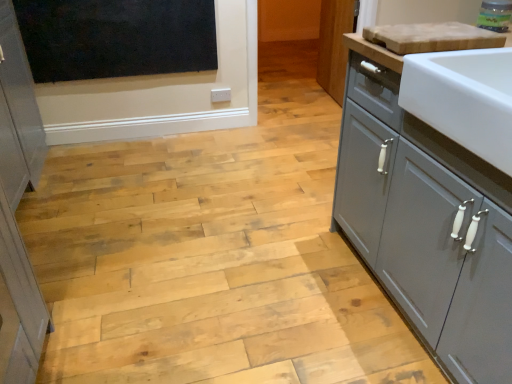
Find the location of a particular element. Image resolution: width=512 pixels, height=384 pixels. white glossy sink at right is located at coordinates (425, 221).

This screenshot has width=512, height=384. I want to click on white glossy sink at right, so click(425, 221).

How different are the orientations of translucent glass jar at upper right and matte gray cabinet at right in degrees?

The angle between the facing direction of translucent glass jar at upper right and the facing direction of matte gray cabinet at right is 95.5 degrees.

Is translucent glass jar at upper right taller or shorter than matte gray cabinet at right?

In the image, translucent glass jar at upper right appears to be shorter than matte gray cabinet at right.

Does translucent glass jar at upper right lie behind matte gray cabinet at right?

That is False.

Between point (488, 14) and point (325, 81), which one is positioned in front?

The point (488, 14) is in front.

Which point is more forward, (397, 55) or (357, 168)?

The point (397, 55) is closer.

From the image's perspective, which is below, light brown wood cutting board at upper right or white glossy sink at right?

white glossy sink at right, from the image's perspective.

From a real-world perspective, is light brown wood cutting board at upper right located beneath white glossy sink at right?

No.

Is white glossy sink at right inside light brown wood cutting board at upper right?

No, white glossy sink at right is not surrounded by light brown wood cutting board at upper right.

Could you measure the distance between translucent glass jar at upper right and light brown wood cutting board at upper right?

translucent glass jar at upper right is 14.10 inches away from light brown wood cutting board at upper right.

At what (x,y) coordinates should I click in order to perform the action: click on appliance to the right of light brown wood cutting board at upper right. Please return your answer as a coordinate pair (x, y). The image size is (512, 384). Looking at the image, I should click on (495, 15).

Is point (501, 7) positioned in front of point (357, 50)?

No, (501, 7) is behind (357, 50).

Is translucent glass jar at upper right far from light brown wood cutting board at upper right?

They are positioned close to each other.

Does point (99, 77) come in front of point (366, 51)?

No, it is not.

Can you tell me how much black matte window screen at upper left and light brown wood cutting board at upper right differ in facing direction?

The angular difference between black matte window screen at upper left and light brown wood cutting board at upper right is 90 degrees.

Could you measure the distance between black matte window screen at upper left and light brown wood cutting board at upper right?

black matte window screen at upper left and light brown wood cutting board at upper right are 1.74 meters apart.

Is black matte window screen at upper left far from light brown wood cutting board at upper right?

Yes.

Considering the positions of objects black matte window screen at upper left and translucent glass jar at upper right in the image provided, who is in front, black matte window screen at upper left or translucent glass jar at upper right?

translucent glass jar at upper right is closer to the camera.

This screenshot has height=384, width=512. In order to click on appliance on the right of black matte window screen at upper left in this screenshot , I will do `click(495, 15)`.

Is black matte window screen at upper left not near translucent glass jar at upper right?

Yes.

From the image's perspective, which object appears higher, black matte window screen at upper left or translucent glass jar at upper right?

black matte window screen at upper left.

In the scene shown: Is black matte window screen at upper left inside translucent glass jar at upper right?

No, translucent glass jar at upper right does not contain black matte window screen at upper left.

Is translucent glass jar at upper right placed right next to black matte window screen at upper left?

No, translucent glass jar at upper right is not in contact with black matte window screen at upper left.

In terms of height, does translucent glass jar at upper right look taller or shorter compared to black matte window screen at upper left?

translucent glass jar at upper right is shorter than black matte window screen at upper left.

Does point (488, 11) come behind point (71, 19)?

No, it is not.

From the image's perspective, is light brown wood cutting board at upper right under translucent glass jar at upper right?

Correct, light brown wood cutting board at upper right appears lower than translucent glass jar at upper right in the image.

Is light brown wood cutting board at upper right inside or outside of translucent glass jar at upper right?

light brown wood cutting board at upper right is outside translucent glass jar at upper right.

Considering the points (361, 36) and (496, 0), which point is in front, point (361, 36) or point (496, 0)?

The point (361, 36) is closer.

Considering the positions of objects light brown wood cutting board at upper right and translucent glass jar at upper right in the image provided, who is more to the right, light brown wood cutting board at upper right or translucent glass jar at upper right?

From the viewer's perspective, translucent glass jar at upper right appears more on the right side.

Identify the location of cabinetry behind the translucent glass jar at upper right. Image resolution: width=512 pixels, height=384 pixels. (334, 46).

The width and height of the screenshot is (512, 384). Identify the location of countertop on the left of white glossy sink at right. (374, 52).

Estimate the real-world distances between objects in this image. Which object is further from translucent glass jar at upper right, white glossy sink at right or light brown wood cutting board at upper right?

The object further to translucent glass jar at upper right is white glossy sink at right.

From the image, which object appears to be farther from white glossy sink at right, matte gray cabinet at right or black matte window screen at upper left?

Based on the image, matte gray cabinet at right appears to be further to white glossy sink at right.

From the picture: Considering their positions, is light brown wood cutting board at upper right positioned closer to black matte window screen at upper left than matte gray cabinet at right?

matte gray cabinet at right lies closer to black matte window screen at upper left than the other object.

When comparing their distances from black matte window screen at upper left, does translucent glass jar at upper right or white glossy sink at right seem closer?

white glossy sink at right is closer to black matte window screen at upper left.

Which object lies nearer to the anchor point matte gray cabinet at right, translucent glass jar at upper right or white glossy sink at right?

translucent glass jar at upper right is closer to matte gray cabinet at right.

Considering their positions, is black matte window screen at upper left positioned closer to white glossy sink at right than matte gray cabinet at right?

black matte window screen at upper left lies closer to white glossy sink at right than the other object.

Considering their positions, is white glossy sink at right positioned further to light brown wood cutting board at upper right than translucent glass jar at upper right?

white glossy sink at right lies further to light brown wood cutting board at upper right than the other object.

From the image, which object appears to be farther from matte gray cabinet at right, light brown wood cutting board at upper right or translucent glass jar at upper right?

light brown wood cutting board at upper right is positioned further to the anchor matte gray cabinet at right.

The width and height of the screenshot is (512, 384). Identify the location of cupboard between black matte window screen at upper left and translucent glass jar at upper right in the horizontal direction. (425, 221).

Find the location of a particular element. The width and height of the screenshot is (512, 384). countertop between black matte window screen at upper left and translucent glass jar at upper right is located at coordinates (374, 52).

This screenshot has height=384, width=512. What are the coordinates of `appliance between light brown wood cutting board at upper right and matte gray cabinet at right in the front-back direction` in the screenshot? It's located at [x=495, y=15].

Locate an element on the screen. The image size is (512, 384). countertop located between white glossy sink at right and translucent glass jar at upper right in the depth direction is located at coordinates tap(374, 52).